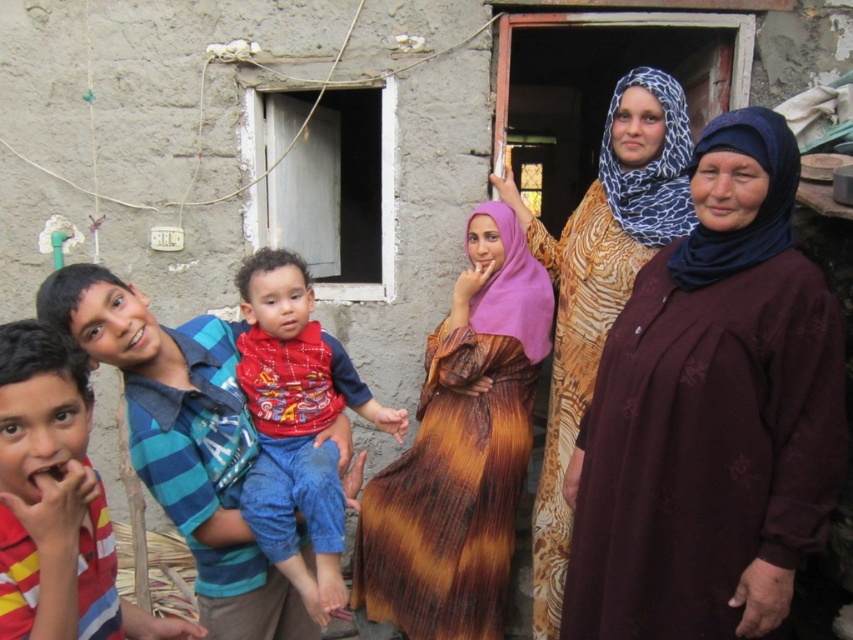
You are taking a photo of the scene and want to focus on both the point at (401, 493) and the point at (339, 568). Which point should you adjust your focus to first to ensure both are in clear view?

You should focus on point (339, 568) first because it is closer to the camera than point (401, 493). By focusing on the closer point, the further point will also be in focus if the depth of field is sufficient.

You are organizing a photoshoot and need to arrange two dresses in the scene. The brown textured dress at center and the printed silk dress at center are both present. Which dress should you move to the back to ensure the smaller one is fully visible?

The printed silk dress at center is larger, so moving it to the back would allow the smaller brown textured dress at center to be fully visible.